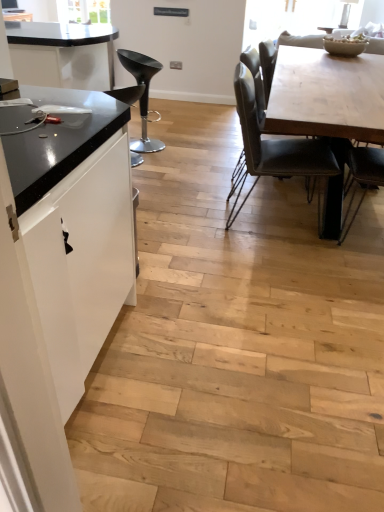
Question: Can black plastic stool at left, acting as the 2th chair starting from the right, be found inside light wood table at center?

Choices:
 (A) no
 (B) yes

Answer: (A)

Question: Considering the relative sizes of light wood table at center and black plastic stool at left, the 2th chair viewed from the left, in the image provided, is light wood table at center bigger than black plastic stool at left, the 2th chair viewed from the left,?

Choices:
 (A) yes
 (B) no

Answer: (A)

Question: Is light wood table at center wider than black plastic stool at left, acting as the 2th chair starting from the right?

Choices:
 (A) no
 (B) yes

Answer: (B)

Question: Can you confirm if light wood table at center is shorter than black plastic stool at left, the 2th chair viewed from the left?

Choices:
 (A) yes
 (B) no

Answer: (A)

Question: Can you confirm if light wood table at center is positioned to the right of black plastic stool at left, acting as the 2th chair starting from the right?

Choices:
 (A) no
 (B) yes

Answer: (B)

Question: Can you confirm if light wood table at center is smaller than black plastic stool at left, the 2th chair viewed from the left?

Choices:
 (A) yes
 (B) no

Answer: (B)

Question: Considering the relative positions of white matte cabinet at left and black leather bar stool at left, placed as the 1th chair when sorted from left to right, in the image provided, is white matte cabinet at left to the left of black leather bar stool at left, placed as the 1th chair when sorted from left to right, from the viewer's perspective?

Choices:
 (A) no
 (B) yes

Answer: (A)

Question: Would you say white matte cabinet at left is a long distance from black leather bar stool at left, placed as the 1th chair when sorted from left to right?

Choices:
 (A) yes
 (B) no

Answer: (A)

Question: Does white matte cabinet at left have a greater width compared to black leather bar stool at left, placed as the 1th chair when sorted from left to right?

Choices:
 (A) no
 (B) yes

Answer: (B)

Question: From a real-world perspective, is white matte cabinet at left beneath black leather bar stool at left, marked as the third chair in a right-to-left arrangement?

Choices:
 (A) no
 (B) yes

Answer: (A)

Question: Does white matte cabinet at left have a lesser width compared to black leather bar stool at left, marked as the third chair in a right-to-left arrangement?

Choices:
 (A) no
 (B) yes

Answer: (A)

Question: Is white matte cabinet at left at the right side of black leather bar stool at left, marked as the third chair in a right-to-left arrangement?

Choices:
 (A) no
 (B) yes

Answer: (B)

Question: Is the surface of black plastic stool at left, the 2th chair viewed from the left, in direct contact with leatherette chair at center, the 1th chair when ordered from right to left?

Choices:
 (A) yes
 (B) no

Answer: (B)